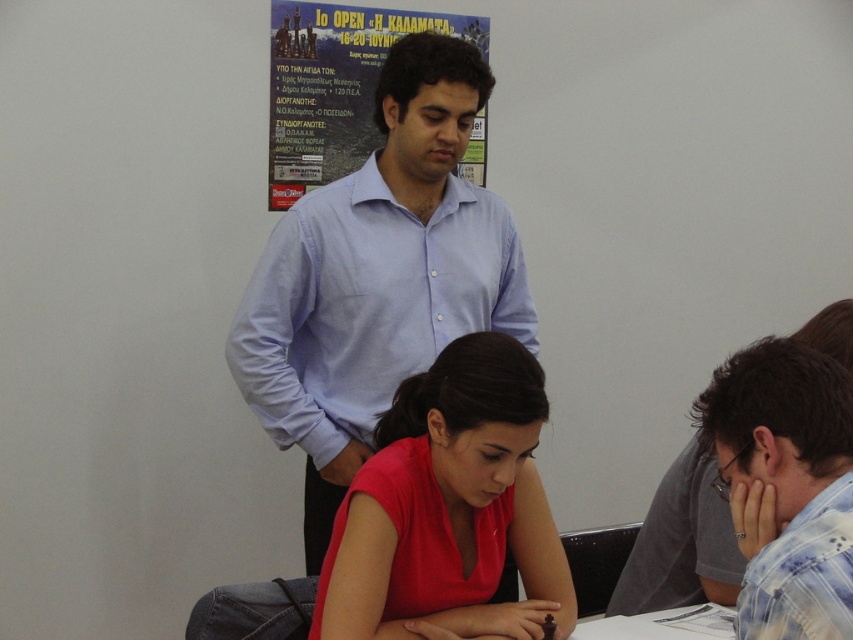
Question: Which object appears farthest from the camera in this image?

Choices:
 (A) matte paper poster at upper center
 (B) matte red shirt at center

Answer: (A)

Question: Which point is farther to the camera?

Choices:
 (A) matte red shirt at center
 (B) light blue shirt at upper center
 (C) blue plaid shirt at lower right

Answer: (B)

Question: Is matte red shirt at center in front of blue plaid shirt at lower right?

Choices:
 (A) yes
 (B) no

Answer: (B)

Question: Which point is farther to the camera?

Choices:
 (A) blue plaid shirt at lower right
 (B) light blue shirt at upper center
 (C) matte paper poster at upper center
 (D) matte red shirt at center

Answer: (C)

Question: Is matte red shirt at center below matte paper poster at upper center?

Choices:
 (A) yes
 (B) no

Answer: (A)

Question: Where is blue plaid shirt at lower right located in relation to matte paper poster at upper center in the image?

Choices:
 (A) above
 (B) below

Answer: (B)